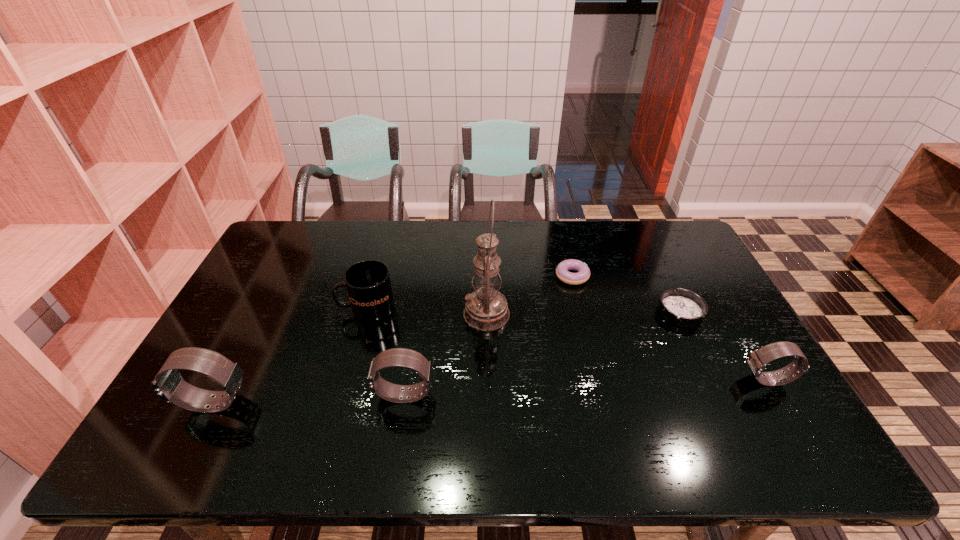
At what (x,y) coordinates should I click in order to perform the action: click on free location at the far left corner of the desktop. Please return your answer as a coordinate pair (x, y). Looking at the image, I should click on (285, 235).

Where is `vacant point located between the ashtray and the leftmost watch`? This screenshot has height=540, width=960. vacant point located between the ashtray and the leftmost watch is located at coordinates (446, 357).

Where is `free spot between the leftmost watch and the tallest object`? Image resolution: width=960 pixels, height=540 pixels. free spot between the leftmost watch and the tallest object is located at coordinates (350, 359).

Find the location of a particular element. This screenshot has width=960, height=540. vacant point located between the shortest watch and the second object from right to left is located at coordinates (724, 346).

I want to click on vacant area that lies between the leftmost object and the ashtray, so click(446, 357).

Identify the location of free spot between the leftmost object and the tallest object. (350, 359).

I want to click on empty location between the second watch from left to right and the fourth object from left to right, so click(x=445, y=354).

At what (x,y) coordinates should I click in order to perform the action: click on free point between the rightmost object and the doughnut. Please return your answer as a coordinate pair (x, y). This screenshot has width=960, height=540. Looking at the image, I should click on (670, 328).

The width and height of the screenshot is (960, 540). Identify the location of empty space between the leftmost watch and the mug. (290, 356).

You are a GUI agent. You are given a task and a screenshot of the screen. Output one action in this format:
    pyautogui.click(x=<x>, y=<y>)
    Task: Click on the vacant area that lies between the ashtray and the mug
    
    Given the screenshot: What is the action you would take?
    pyautogui.click(x=524, y=310)